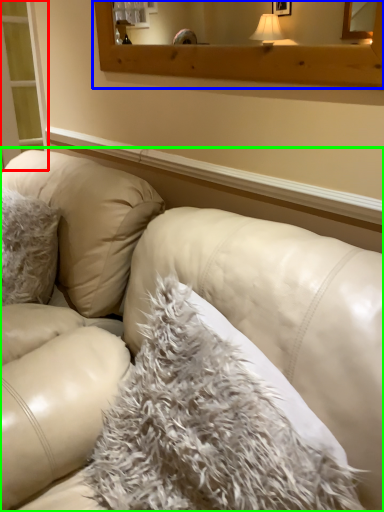
Question: Which object is positioned farthest from screen door (highlighted by a red box)? Select from window frame (highlighted by a blue box) and studio couch (highlighted by a green box).

Choices:
 (A) window frame
 (B) studio couch

Answer: (B)